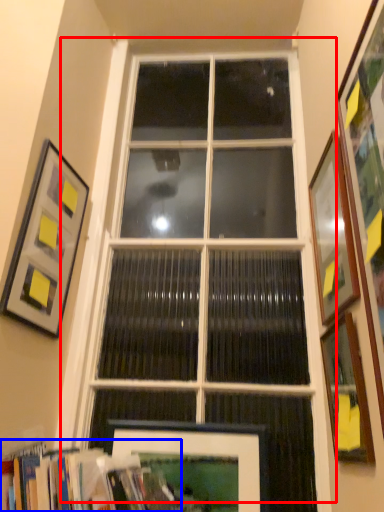
Question: Which of the following is the closest to the observer, window (highlighted by a red box) or bookcase (highlighted by a blue box)?

Choices:
 (A) window
 (B) bookcase

Answer: (B)